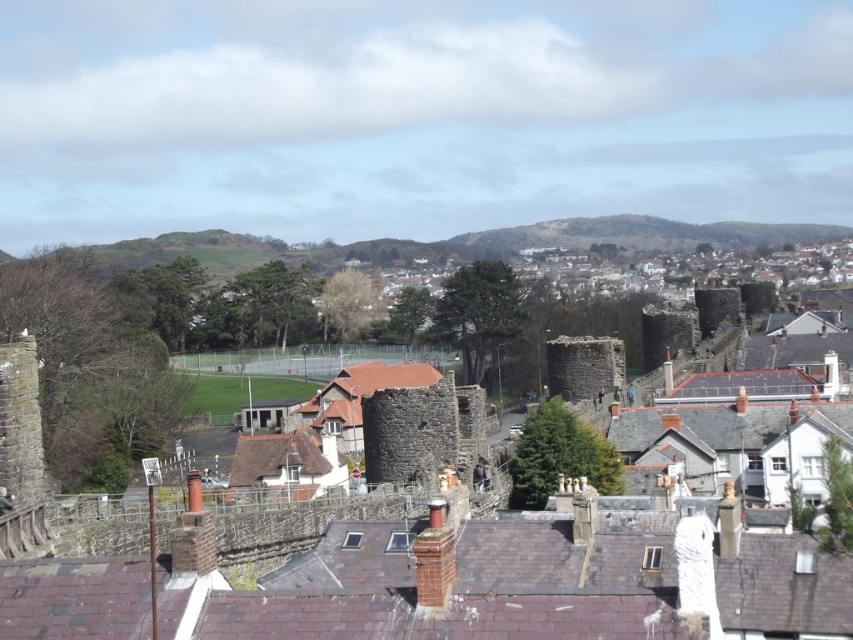
You are a town planner reviewing the layout of the town. You need to determine which structure is taller between the stone wall at center and the stone tower at center. Which one is taller?

The stone tower at center is taller than the stone wall at center according to the description.

You are a painter setting up an easel to paint the town. You want to ensure both the stone wall at center and the stone tower at center are fully visible in your painting. Based on their widths, which object should you position closer to the center of your canvas to avoid cropping?

The stone wall at center might be wider than the stone tower at center, so to ensure both are fully visible, position the stone wall at center closer to the center of the canvas since it is wider and requires more space.

You are an architect designing a new pathway that needs to pass between the stone wall at center and the stone tower at center. Based on their positions, which structure should the pathway be designed to go around to avoid obstruction?

The stone wall at center is located above the stone tower at center, so the pathway should be designed to go around the stone tower at center to avoid obstruction.